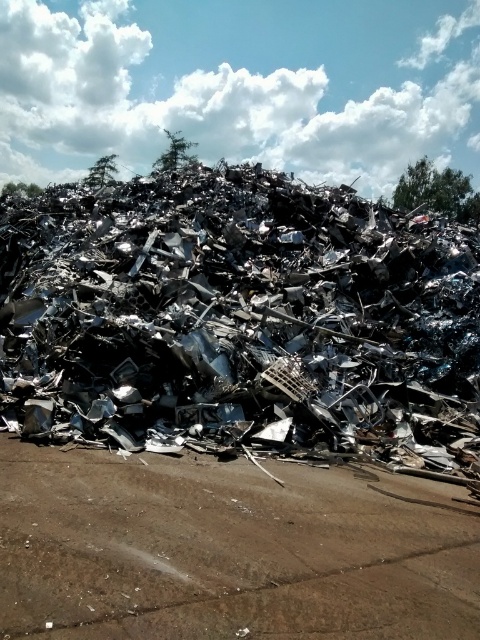
Between metallic debris at center and brown dirt track at center, which one has more height?

metallic debris at center

Identify the location of metallic debris at center. (240, 321).